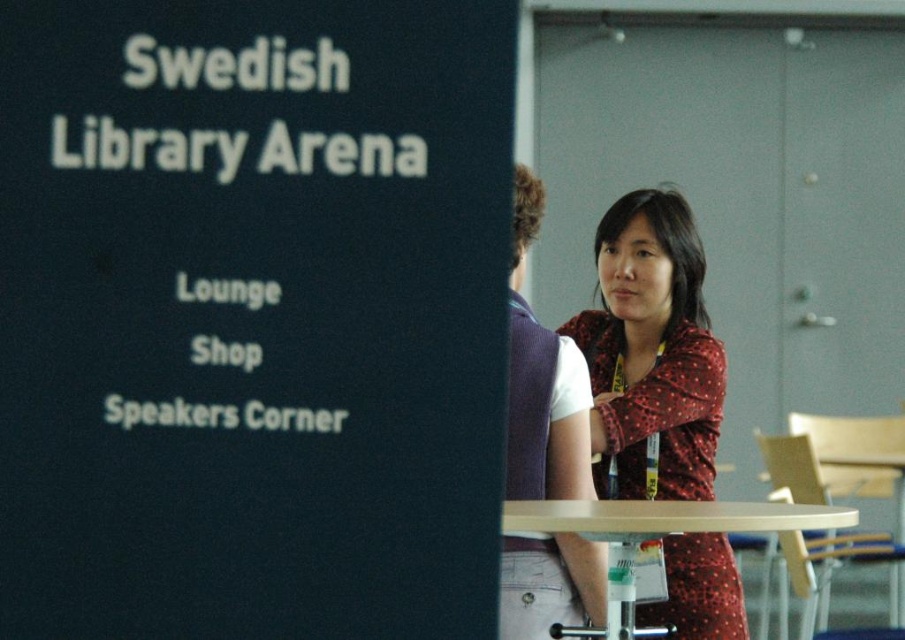
Based on the photo, you are standing in the Swedish Library Arena venue and want to move from the sign to the exit. You notice two points marked on the floor. The first point is at coordinate point [545,374] and the second is at point [561,625]. Which point is closer to you as you face the sign?

Point [545,374] is closer to you because it is further to the camera than point [561,625], meaning it is nearer to your current position facing the sign.

You are at the Swedish Library Arena event and see two people wearing a polka dot fabric shirt at center and a matte red dress at center. Which clothing item is positioned to the right?

The polka dot fabric shirt at center is positioned to the right of the matte red dress at center.